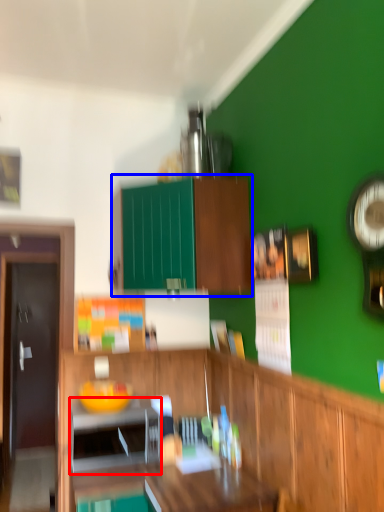
Question: Which of the following is the closest to the observer, appliance (highlighted by a red box) or cabinetry (highlighted by a blue box)?

Choices:
 (A) appliance
 (B) cabinetry

Answer: (B)